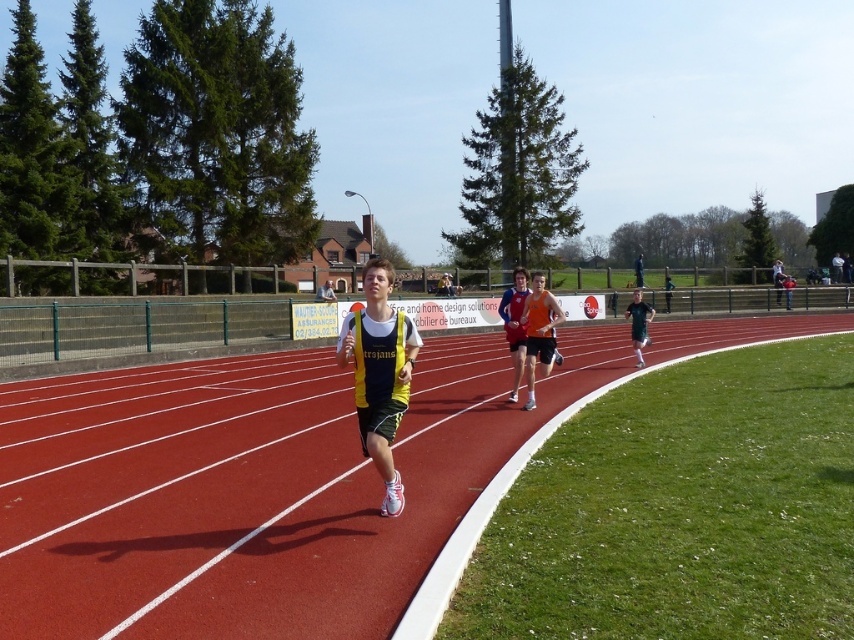
Can you confirm if blue jersey at center is shorter than black athletic shorts at right?

In fact, blue jersey at center may be taller than black athletic shorts at right.

Where is `blue jersey at center`? The height and width of the screenshot is (640, 854). blue jersey at center is located at coordinates (515, 323).

Is orange matte tank top at center bigger than black athletic shorts at right?

Actually, orange matte tank top at center might be smaller than black athletic shorts at right.

Is point (545, 365) positioned after point (633, 324)?

No, it is in front of (633, 324).

Does point (531, 276) come closer to viewer compared to point (639, 337)?

Yes, point (531, 276) is closer to viewer.

At what (x,y) coordinates should I click in order to perform the action: click on orange matte tank top at center. Please return your answer as a coordinate pair (x, y). The image size is (854, 640). Looking at the image, I should click on (539, 332).

Does red rubber track at center appear on the right side of black athletic shorts at right?

No, red rubber track at center is not to the right of black athletic shorts at right.

Which is below, red rubber track at center or black athletic shorts at right?

red rubber track at center

Is point (276, 552) behind point (635, 339)?

No, (276, 552) is in front of (635, 339).

You are a GUI agent. You are given a task and a screenshot of the screen. Output one action in this format:
    pyautogui.click(x=<x>, y=<y>)
    Task: Click on the red rubber track at center
    
    Given the screenshot: What is the action you would take?
    pyautogui.click(x=249, y=490)